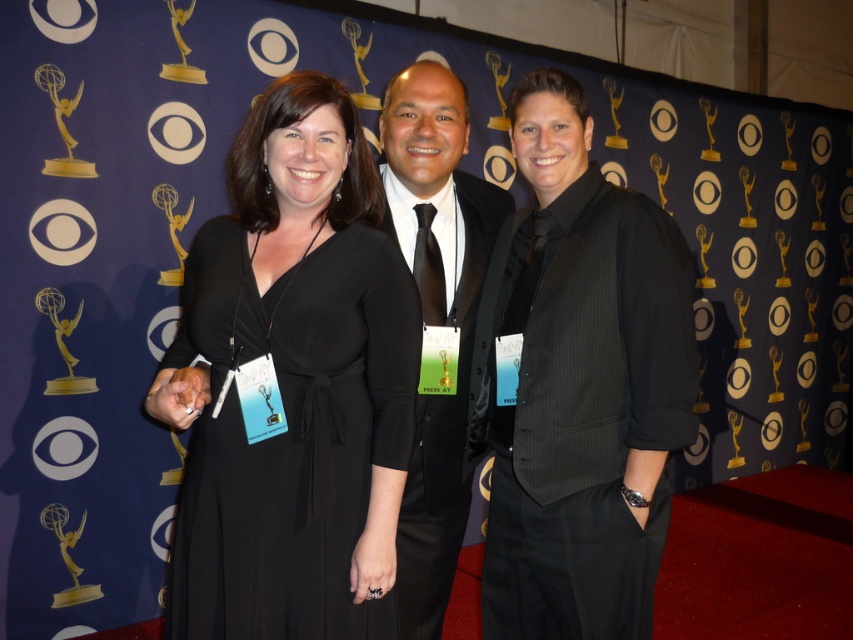
Looking at this image, does matte black vest at center have a greater height compared to black satin dress at center?

Yes.

From the picture: Which of these two, matte black vest at center or black satin dress at center, stands taller?

matte black vest at center

Is point (607, 275) behind point (306, 269)?

Yes, it is.

This screenshot has height=640, width=853. I want to click on matte black vest at center, so click(578, 385).

Does matte black vest at center appear on the right side of black pinstripe suit at center?

Correct, you'll find matte black vest at center to the right of black pinstripe suit at center.

Is point (502, 317) farther from camera compared to point (427, 568)?

No, (502, 317) is in front of (427, 568).

Is point (537, 205) less distant than point (469, 230)?

Yes, point (537, 205) is closer to viewer.

In order to click on matte black vest at center in this screenshot , I will do `click(578, 385)`.

Does black satin dress at center lie behind black pinstripe suit at center?

No.

Does point (218, 364) come in front of point (448, 264)?

Yes, point (218, 364) is closer to viewer.

Locate an element on the screen. black satin dress at center is located at coordinates (289, 435).

This screenshot has width=853, height=640. Find the location of `black satin dress at center`. black satin dress at center is located at coordinates (289, 435).